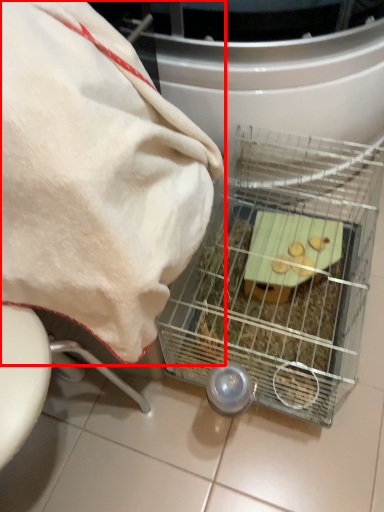
Question: From the image's perspective, considering the relative positions of towel (annotated by the red box) and appliance in the image provided, where is towel (annotated by the red box) located with respect to the staircase?

Choices:
 (A) below
 (B) above

Answer: (B)